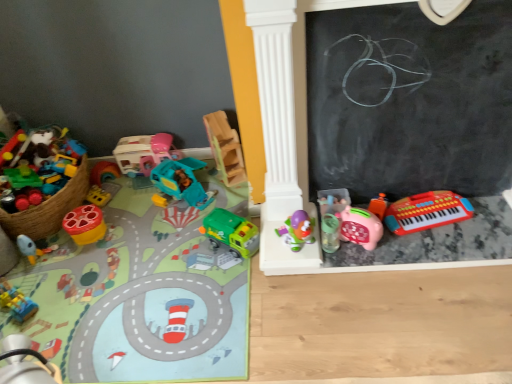
I want to click on vacant area that lies in front of translucent plastic playhouse at center-left, the eighth toy from the right, so click(135, 196).